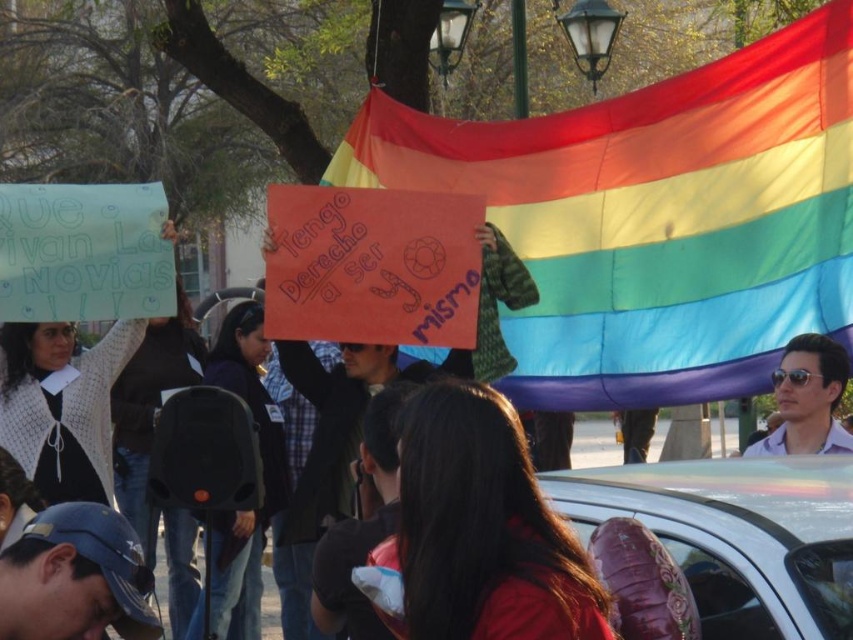
Question: Which point is farther to the camera?

Choices:
 (A) (541, 339)
 (B) (784, 358)

Answer: (A)

Question: Is dark brown hair at center positioned before sunglasses matte man at right?

Choices:
 (A) no
 (B) yes

Answer: (B)

Question: Which object is farther from the camera taking this photo?

Choices:
 (A) sunglasses matte man at right
 (B) dark brown hair at center

Answer: (A)

Question: Can you confirm if rainbow fabric flag at center is positioned above sunglasses matte man at right?

Choices:
 (A) yes
 (B) no

Answer: (A)

Question: Among these objects, which one is nearest to the camera?

Choices:
 (A) sunglasses matte man at right
 (B) rainbow fabric flag at center

Answer: (A)

Question: Is rainbow fabric flag at center bigger than sunglasses matte man at right?

Choices:
 (A) yes
 (B) no

Answer: (A)